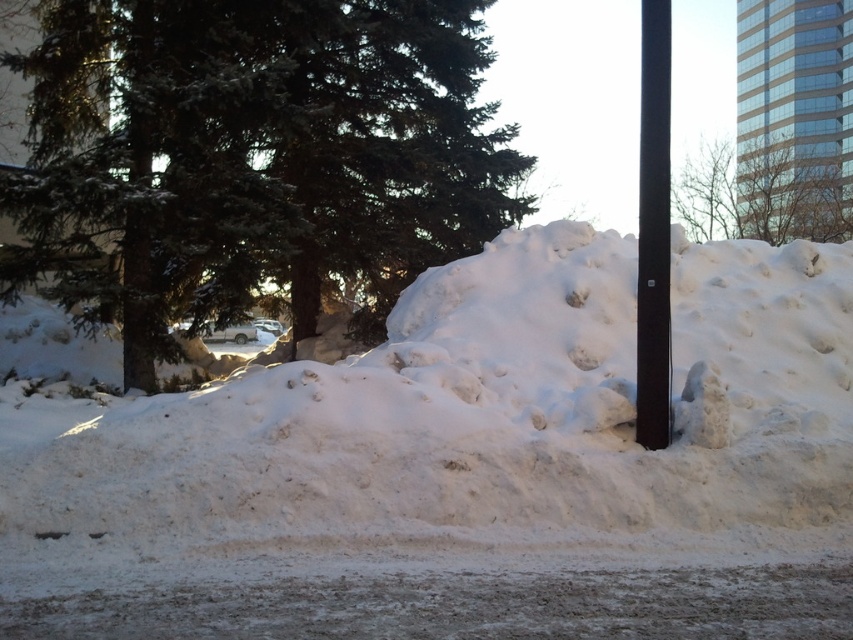
You are a delivery robot that needs to navigate through the snowy scene. You see the white fluffy snow at center and the black smooth pole at right. Which object is closer to you, the delivery robot?

The white fluffy snow at center is closer to you because it is further to the viewer than the black smooth pole at right.

You are a snowplow driver trying to clear the road. You see the white fluffy snow at center and the black smooth pole at right. Which object takes up more horizontal space in the image?

The black smooth pole at right takes up more horizontal space than the white fluffy snow at center because the white fluffy snow at center has a lesser width compared to black smooth pole at right.

You are a snowman builder and want to use the white fluffy snow at center and the black smooth pole at right. Can you use both items to build a snowman?

The white fluffy snow at center has a smaller size compared to black smooth pole at right, so it is not suitable to build a snowman with the black smooth pole at right as it is larger. However, the white fluffy snow at center alone might be sufficient for a small snowman, but the pole cannot be used as a structural part since it is not snow.